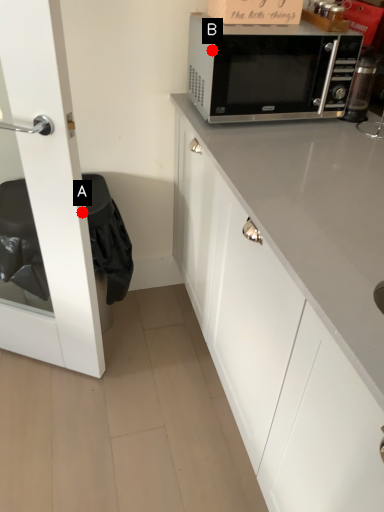
Question: Two points are circled on the image, labeled by A and B beside each circle. Which of the following is the farthest from the observer?

Choices:
 (A) A is further
 (B) B is further

Answer: (B)